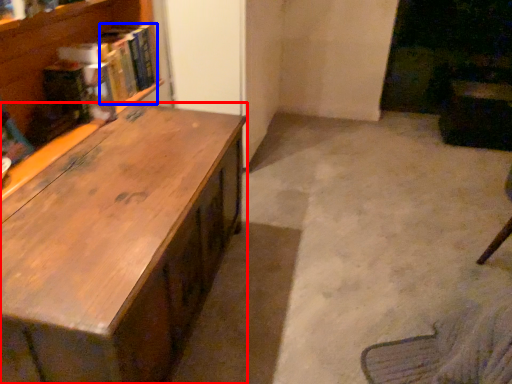
Question: Which object is closer to the camera taking this photo, desk (highlighted by a red box) or book (highlighted by a blue box)?

Choices:
 (A) desk
 (B) book

Answer: (A)